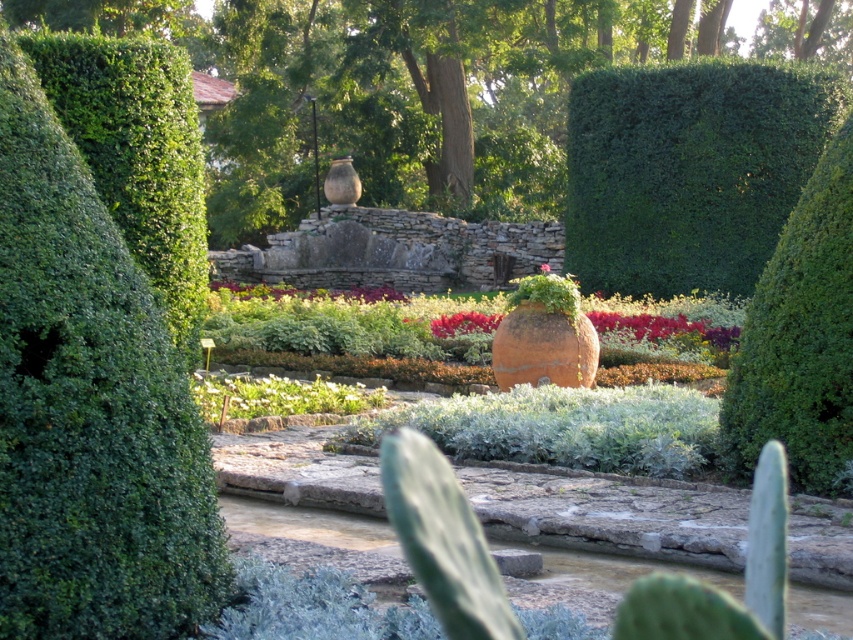
Can you confirm if green leafy hedge at left is positioned above green leafy hedge at upper right?

Incorrect, green leafy hedge at left is not positioned above green leafy hedge at upper right.

Does green leafy hedge at left have a greater height compared to green leafy hedge at upper right?

In fact, green leafy hedge at left may be shorter than green leafy hedge at upper right.

Where is `green leafy hedge at left`? The image size is (853, 640). green leafy hedge at left is located at coordinates (90, 408).

What do you see at coordinates (137, 154) in the screenshot?
I see `green leafy bush at left` at bounding box center [137, 154].

In the scene shown: Which of these two, green leafy bush at left or green leafy bush at right, stands shorter?

Standing shorter between the two is green leafy bush at left.

In order to click on green leafy bush at left in this screenshot , I will do `click(137, 154)`.

You are a GUI agent. You are given a task and a screenshot of the screen. Output one action in this format:
    pyautogui.click(x=<x>, y=<y>)
    Task: Click on the green leafy bush at left
    
    Given the screenshot: What is the action you would take?
    pyautogui.click(x=137, y=154)

Can you confirm if green leafy bush at right is positioned to the left of pink matte flower at center?

Incorrect, green leafy bush at right is not on the left side of pink matte flower at center.

Is point (846, 442) in front of point (540, 272)?

Yes.

Is point (790, 413) positioned in front of point (538, 269)?

That is True.

What are the coordinates of `green leafy bush at right` in the screenshot? It's located at (799, 337).